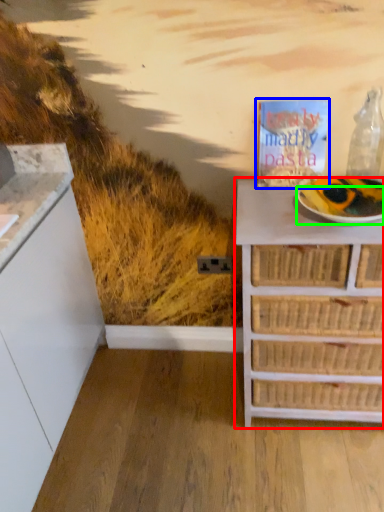
Question: Considering the real-world distances, which object is closest to chest of drawers (highlighted by a red box)? magazine (highlighted by a blue box) or paper plate (highlighted by a green box).

Choices:
 (A) magazine
 (B) paper plate

Answer: (B)